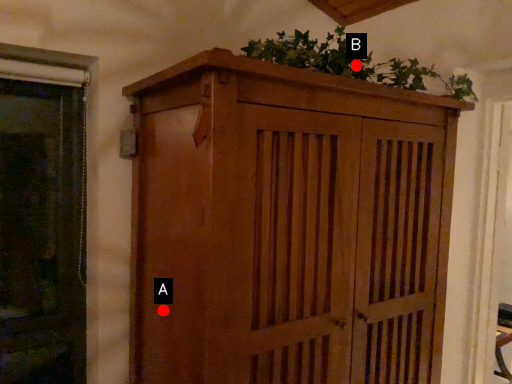
Question: Two points are circled on the image, labeled by A and B beside each circle. Among these points, which one is nearest to the camera?

Choices:
 (A) A is closer
 (B) B is closer

Answer: (A)